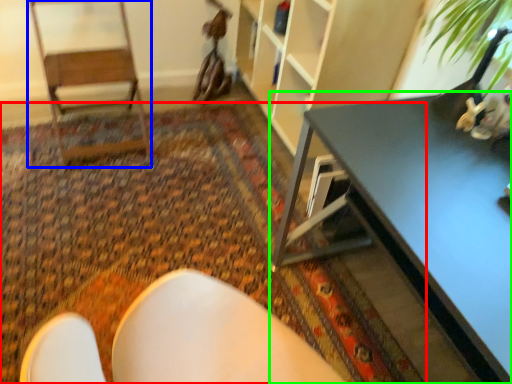
Question: Which object is positioned closest to mat (highlighted by a red box)? Select from armchair (highlighted by a blue box) and table (highlighted by a green box).

Choices:
 (A) armchair
 (B) table

Answer: (A)